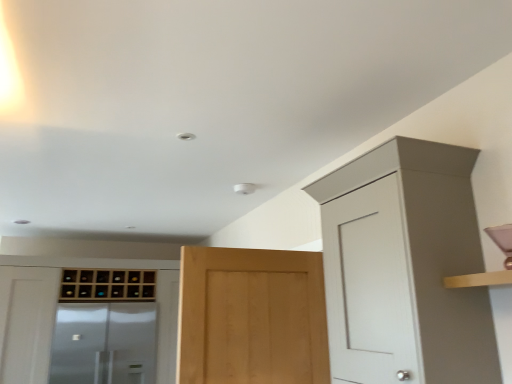
Question: Considering the relative sizes of transparent glass screen door at lower left and light brown wood door at center in the image provided, is transparent glass screen door at lower left thinner than light brown wood door at center?

Choices:
 (A) no
 (B) yes

Answer: (A)

Question: Is transparent glass screen door at lower left closer to camera compared to light brown wood door at center?

Choices:
 (A) no
 (B) yes

Answer: (A)

Question: Is the surface of transparent glass screen door at lower left in direct contact with light brown wood door at center?

Choices:
 (A) yes
 (B) no

Answer: (B)

Question: Can you confirm if transparent glass screen door at lower left is wider than light brown wood door at center?

Choices:
 (A) no
 (B) yes

Answer: (B)

Question: Can you confirm if transparent glass screen door at lower left is positioned to the left of light brown wood door at center?

Choices:
 (A) no
 (B) yes

Answer: (B)

Question: Is point (401, 309) positioned closer to the camera than point (166, 344)?

Choices:
 (A) farther
 (B) closer

Answer: (B)

Question: Relative to wooden wine rack at left, acting as the 2th cabinetry starting from the back, is matte white cabinet at upper right, the third cabinetry from the back, in front or behind?

Choices:
 (A) front
 (B) behind

Answer: (A)

Question: In terms of height, does matte white cabinet at upper right, the third cabinetry from the back, look taller or shorter compared to wooden wine rack at left, positioned as the third cabinetry in right-to-left order?

Choices:
 (A) tall
 (B) short

Answer: (B)

Question: Is matte white cabinet at upper right, placed as the third cabinetry when sorted from left to right, wider or thinner than wooden wine rack at left, acting as the 1th cabinetry starting from the left?

Choices:
 (A) thin
 (B) wide

Answer: (A)

Question: Is wooden wine rack at left, marked as the second cabinetry in a front-to-back arrangement, inside the boundaries of transparent glass screen door at lower left, or outside?

Choices:
 (A) inside
 (B) outside

Answer: (B)

Question: In terms of size, does wooden wine rack at left, acting as the 2th cabinetry starting from the back, appear bigger or smaller than transparent glass screen door at lower left?

Choices:
 (A) big
 (B) small

Answer: (A)

Question: Considering the positions of wooden wine rack at left, positioned as the third cabinetry in right-to-left order, and transparent glass screen door at lower left in the image, is wooden wine rack at left, positioned as the third cabinetry in right-to-left order, wider or thinner than transparent glass screen door at lower left?

Choices:
 (A) wide
 (B) thin

Answer: (A)

Question: Is wooden wine rack at left, positioned as the third cabinetry in right-to-left order, in front of or behind transparent glass screen door at lower left in the image?

Choices:
 (A) behind
 (B) front

Answer: (B)

Question: Is wooden wine rack at center, which is the 1th cabinetry in back-to-front order, in front of or behind light brown wood door at center in the image?

Choices:
 (A) front
 (B) behind

Answer: (B)

Question: From the image's perspective, is wooden wine rack at center, positioned as the 3th cabinetry in front-to-back order, above or below light brown wood door at center?

Choices:
 (A) above
 (B) below

Answer: (B)